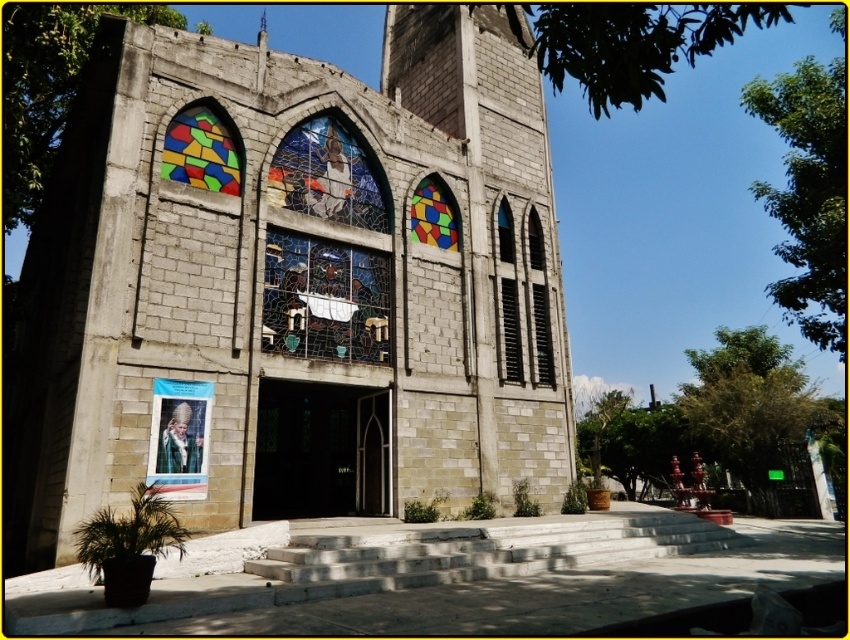
Question: Can you confirm if black glass door at center is wider than stained glass window at upper center?

Choices:
 (A) no
 (B) yes

Answer: (B)

Question: Can you confirm if stained glass window at center is bigger than black glass door at center?

Choices:
 (A) yes
 (B) no

Answer: (B)

Question: Considering the real-world distances, which object is farthest from the gray stone church at center?

Choices:
 (A) stained glass window at center
 (B) stained glass window at upper center
 (C) black glass door at center

Answer: (B)

Question: Which point is farther to the camera?

Choices:
 (A) black glass door at center
 (B) gray stone church at center
 (C) stained glass window at upper center

Answer: (C)

Question: Which of the following is the farthest from the observer?

Choices:
 (A) stained glass window at upper center
 (B) gray stone church at center
 (C) black glass door at center

Answer: (A)

Question: Does black glass door at center have a smaller size compared to stained glass window at upper center?

Choices:
 (A) yes
 (B) no

Answer: (B)